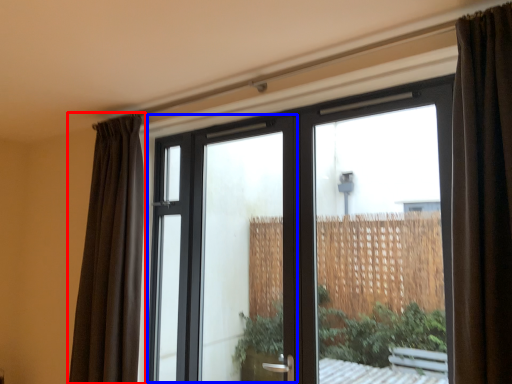
Question: Which object appears closest to the camera in this image, curtain (highlighted by a red box) or screen door (highlighted by a blue box)?

Choices:
 (A) curtain
 (B) screen door

Answer: (B)